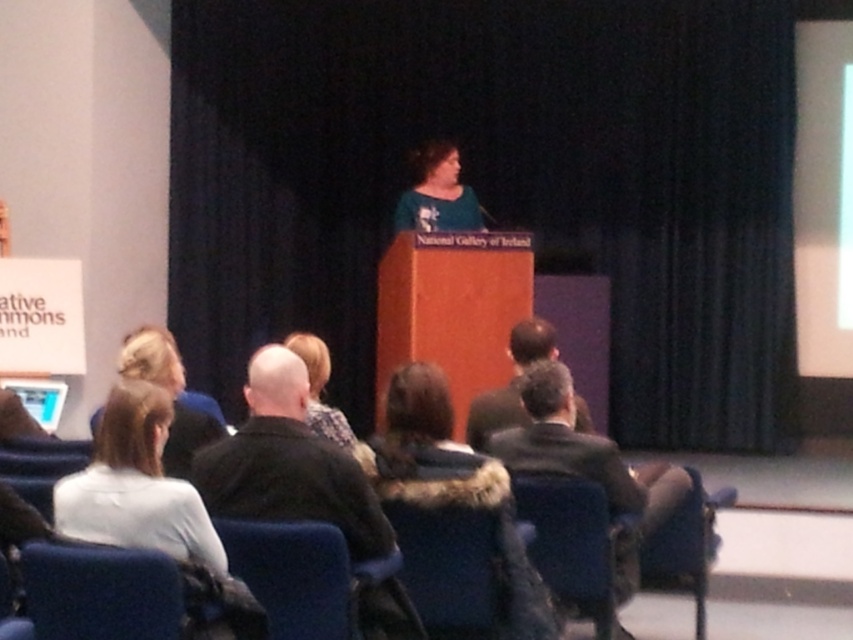
Is dark brown suit at center smaller than blue fabric chair at lower center?

No.

Looking at this image, measure the distance between dark brown suit at center and blue fabric chair at lower center.

dark brown suit at center is 1.10 meters from blue fabric chair at lower center.

I want to click on dark brown suit at center, so click(589, 464).

Locate an element on the screen. The image size is (853, 640). dark brown suit at center is located at coordinates (589, 464).

Is point (421, 570) positioned before point (509, 337)?

That is True.

Between matte blue chair at lower center and dark brown leather jacket at center, which one appears on the right side from the viewer's perspective?

Positioned to the right is dark brown leather jacket at center.

Locate an element on the screen. matte blue chair at lower center is located at coordinates (448, 566).

The height and width of the screenshot is (640, 853). I want to click on matte blue chair at lower center, so click(x=448, y=566).

Is matte blue chair at lower center taller than velvet blue chair at lower center?

No, matte blue chair at lower center is not taller than velvet blue chair at lower center.

Who is shorter, matte blue chair at lower center or velvet blue chair at lower center?

matte blue chair at lower center is shorter.

Describe the element at coordinates (448, 566) in the screenshot. I see `matte blue chair at lower center` at that location.

Where is `matte blue chair at lower center`? matte blue chair at lower center is located at coordinates (448, 566).